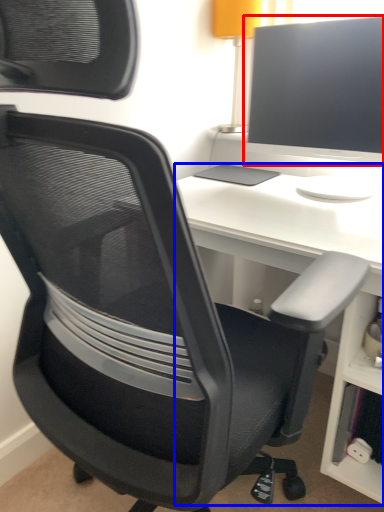
Question: Among these objects, which one is nearest to the camera, computer monitor (highlighted by a red box) or desk (highlighted by a blue box)?

Choices:
 (A) computer monitor
 (B) desk

Answer: (B)